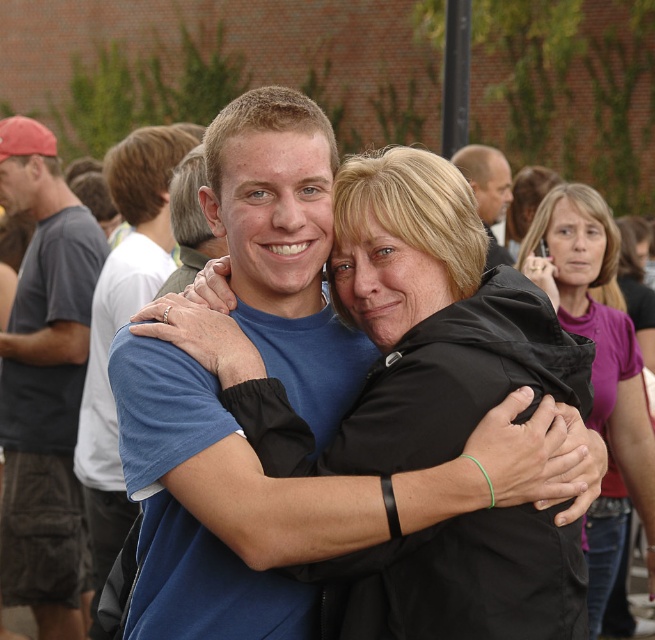
You are standing at the point labeled point (10, 451) and want to move to the point labeled point (500, 259). Will you need to walk forward or backward to reach your destination?

Since point (10, 451) is in front of point (500, 259), you will need to walk backward to reach point (500, 259) from your current position.